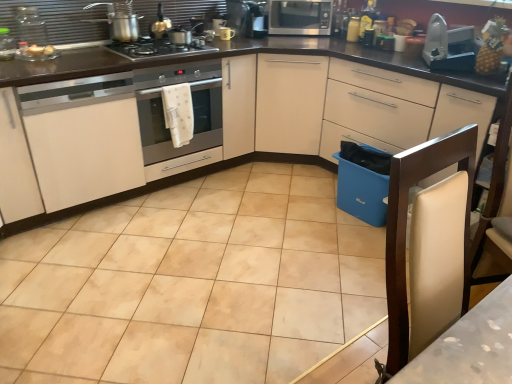
Locate an element on the screen. free region under metallic silver coffee maker at upper center, which ranks as the 3th appliance in right-to-left order (from a real-world perspective) is located at coordinates (249, 33).